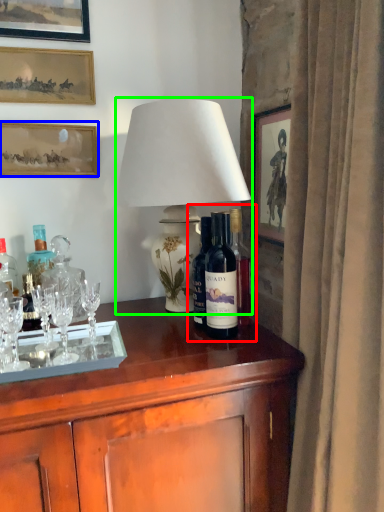
Question: Estimate the real-world distances between objects in this image. Which object is closer to wine tasting (highlighted by a red box), picture frame (highlighted by a blue box) or lamp (highlighted by a green box)?

Choices:
 (A) picture frame
 (B) lamp

Answer: (B)